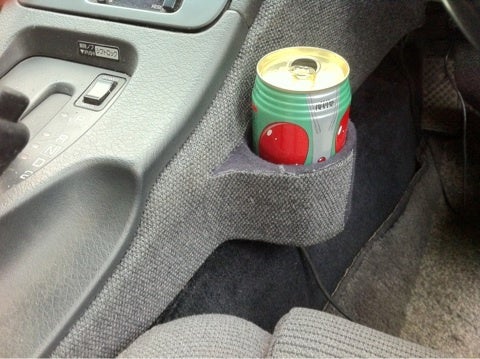
Identify the location of console. The height and width of the screenshot is (359, 480). (172, 88).